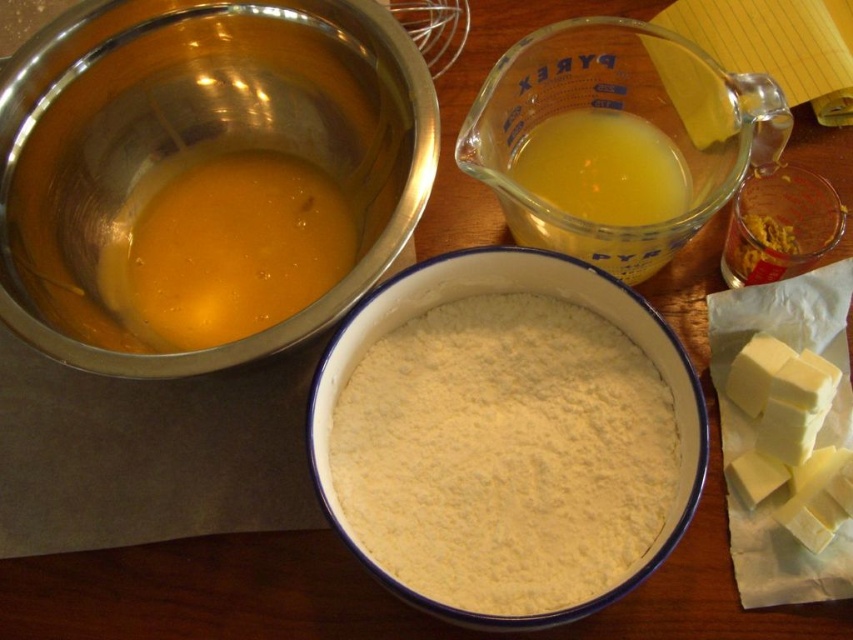
Based on the photo, between shiny metallic bowl at upper left and white powder at center, which one appears on the right side from the viewer's perspective?

Positioned to the right is white powder at center.

In the scene shown: Does shiny metallic bowl at upper left have a lesser width compared to white powder at center?

Incorrect, shiny metallic bowl at upper left's width is not less than white powder at center's.

Locate an element on the screen. shiny metallic bowl at upper left is located at coordinates (201, 141).

Is translucent glass measuring cup at upper center bigger than yellow crumbly mixture at upper right?

Yes.

Can you confirm if translucent glass measuring cup at upper center is smaller than yellow crumbly mixture at upper right?

No, translucent glass measuring cup at upper center is not smaller than yellow crumbly mixture at upper right.

Is point (622, 241) closer to viewer compared to point (735, 248)?

Yes, point (622, 241) is in front of point (735, 248).

This screenshot has width=853, height=640. I want to click on translucent glass measuring cup at upper center, so click(x=602, y=170).

The height and width of the screenshot is (640, 853). What do you see at coordinates (505, 452) in the screenshot?
I see `white powder at center` at bounding box center [505, 452].

Does white powder at center lie behind translucent glass measuring cup at upper center?

That is False.

At what (x,y) coordinates should I click in order to perform the action: click on white powder at center. Please return your answer as a coordinate pair (x, y). This screenshot has width=853, height=640. Looking at the image, I should click on (505, 452).